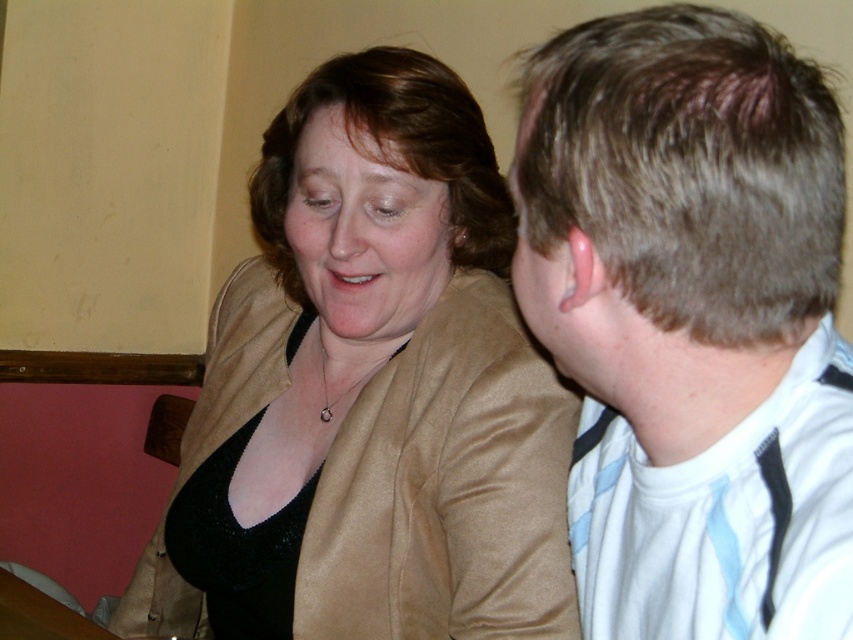
You are a tailor measuring clothes for customers. You have two garments to compare in the image. Which one is bigger, the satin gold jacket at upper left or the white striped shirt at right?

The satin gold jacket at upper left is larger in size than the white striped shirt at right according to the description.

You are a tailor measuring the distance between two garments for a display. The satin gold jacket at upper left and the white striped shirt at right are to be placed on a mannequin. Can a 14.5 inch wide mannequin fit both items without overlapping?

The distance between the satin gold jacket at upper left and white striped shirt at right is 14.83 inches, so the 14.5 inch wide mannequin is slightly too narrow to fit both items without overlapping.

You are standing in the room where the two people are sitting. You need to locate the satin gold jacket at upper left. Where exactly is it located in the room?

The satin gold jacket at upper left is located at point (x=369, y=394) in the room.